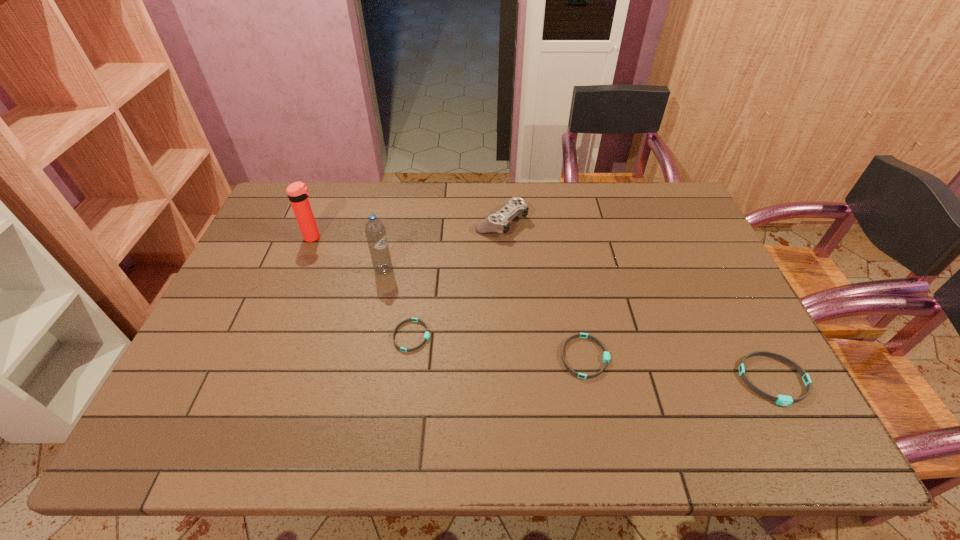
Please show where to add a wristband on the left while keeping spacing even. Please provide its 2D coordinates. Your answer should be formatted as a tuple, i.e. [(x, y)], where the tuple contains the x and y coordinates of a point satisfying the conditions above.

[(252, 316)]